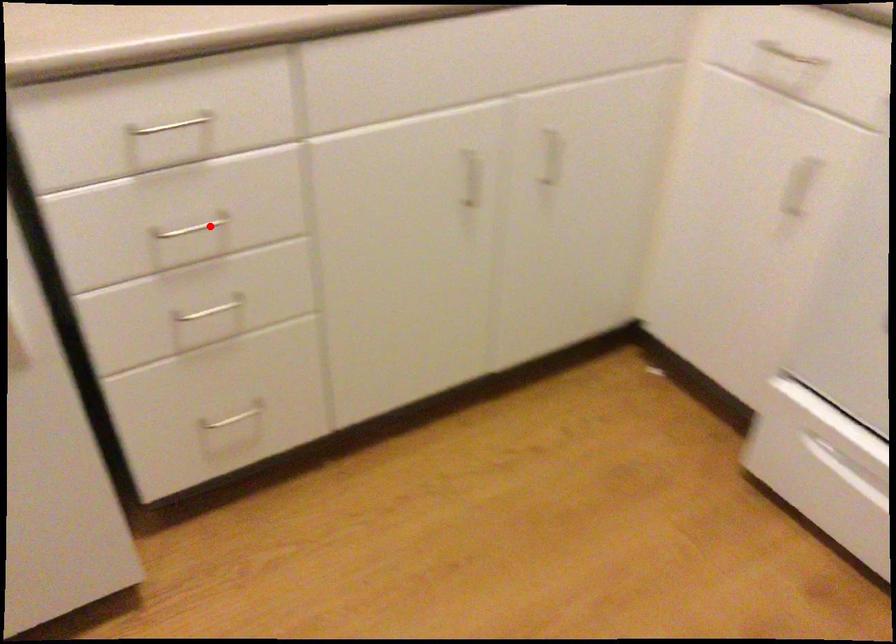
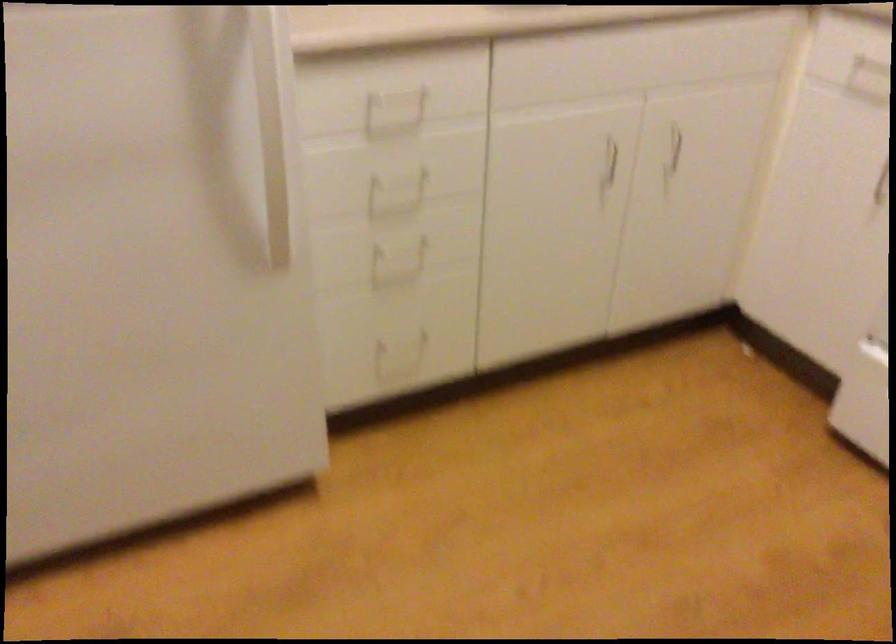
Question: I am providing you with two images of the same scene from different viewpoints. In image1, a red point is highlighted. Considering the same 3D point in image2, which of the following is correct?

Choices:
 (A) It is closer
 (B) It is farther

Answer: (B)